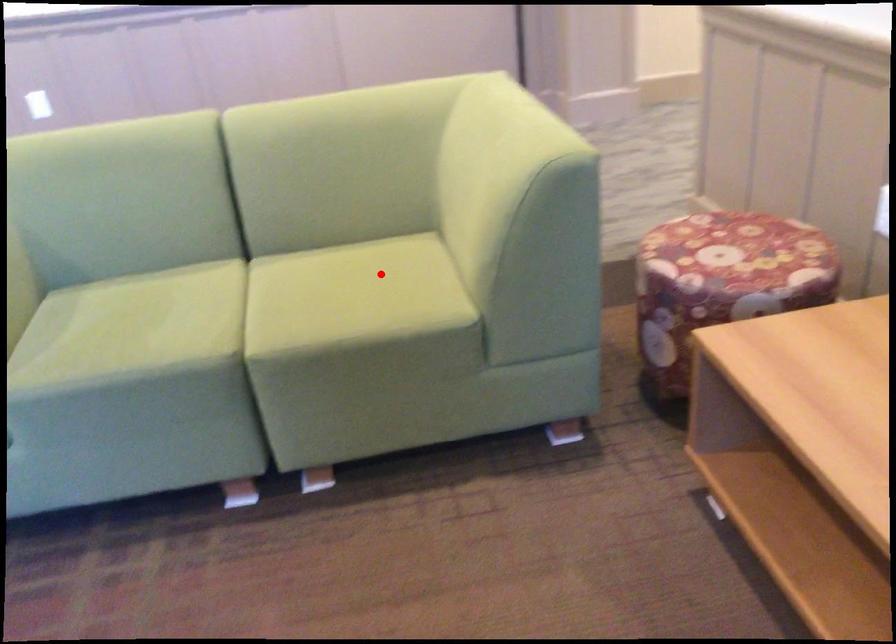
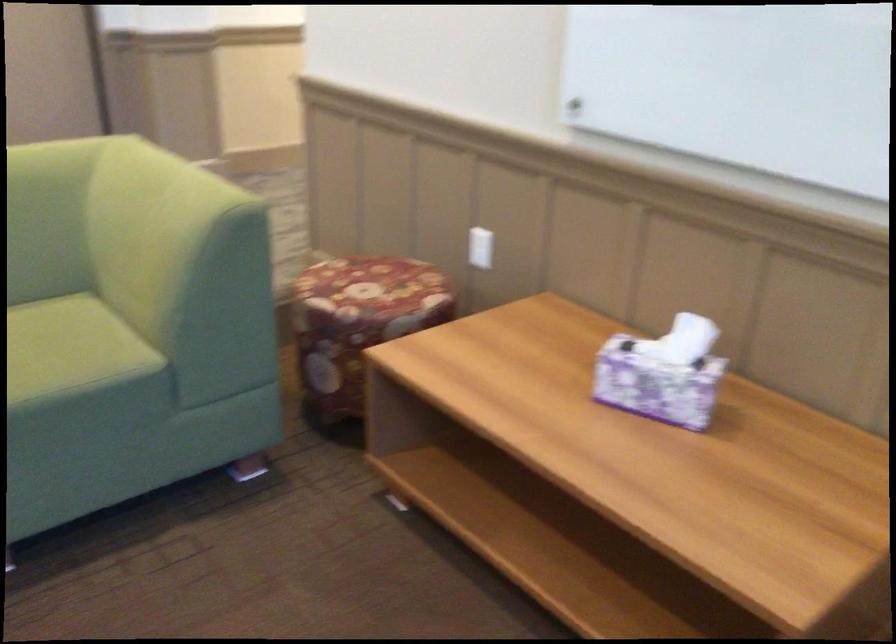
The point at the highlighted location is marked in the first image. Where is the corresponding point in the second image?

(46, 339)